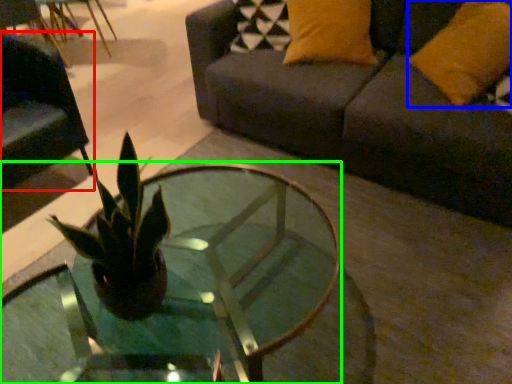
Question: Considering the real-world distances, which object is farthest from swivel chair (highlighted by a red box)? pillow (highlighted by a blue box) or coffee table (highlighted by a green box)?

Choices:
 (A) pillow
 (B) coffee table

Answer: (A)